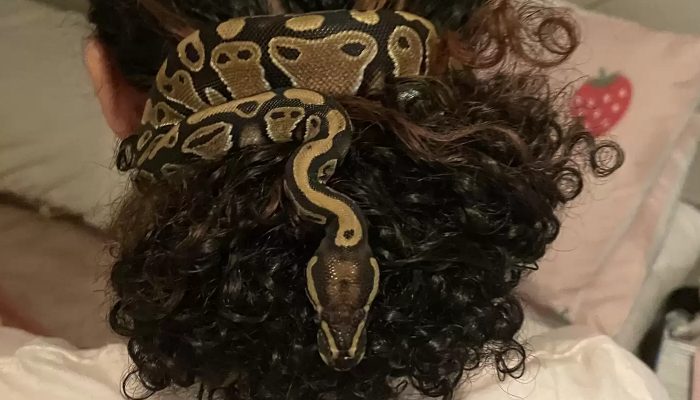
Find the location of a particular element. The image size is (700, 400). pink pillow is located at coordinates (640, 199).